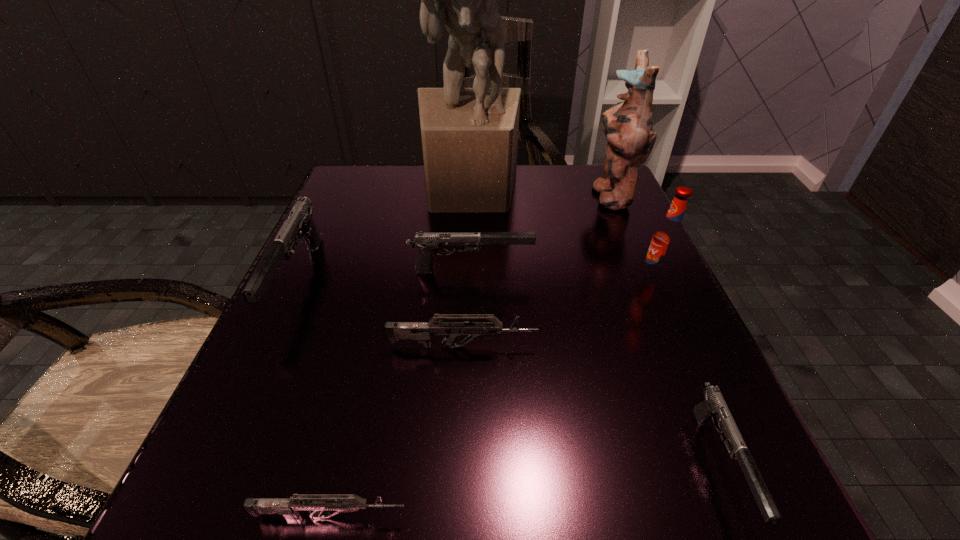
You are a GUI agent. You are given a task and a screenshot of the screen. Output one action in this format:
    pyautogui.click(x=<x>, y=<y>)
    Task: Click on the sixth farthest object
    Image resolution: width=960 pixels, height=540 pixels.
    Given the screenshot: What is the action you would take?
    pyautogui.click(x=421, y=331)

Where is `the bigger grey gun`? Image resolution: width=960 pixels, height=540 pixels. the bigger grey gun is located at coordinates (421, 331).

Locate an element on the screen. This screenshot has width=960, height=540. the shortest gun is located at coordinates (288, 507).

Locate an element on the screen. This screenshot has width=960, height=540. the shortest object is located at coordinates (288, 507).

Where is `vacant space positioned on the front-facing side of the gray sculpture`? vacant space positioned on the front-facing side of the gray sculpture is located at coordinates (463, 362).

You are a GUI agent. You are given a task and a screenshot of the screen. Output one action in this format:
    pyautogui.click(x=<x>, y=<y>)
    Task: Click on the free space located 0.370m on the front-facing side of the figurine
    The width and height of the screenshot is (960, 540).
    Given the screenshot: What is the action you would take?
    pyautogui.click(x=423, y=195)

Locate an element on the screen. vacant point located 0.270m on the front-facing side of the figurine is located at coordinates (468, 195).

You are a GUI agent. You are given a task and a screenshot of the screen. Output one action in this format:
    pyautogui.click(x=<x>, y=<y>)
    Task: Click on the vacant region located 0.350m on the front-facing side of the figurine
    
    Given the screenshot: What is the action you would take?
    pyautogui.click(x=432, y=195)

Where is `vacant space situated 0.210m on the back of the sixth shortest object`? The image size is (960, 540). vacant space situated 0.210m on the back of the sixth shortest object is located at coordinates (622, 206).

Identify the location of vacant position located at the muzzle end of the leftmost object. The height and width of the screenshot is (540, 960). (204, 481).